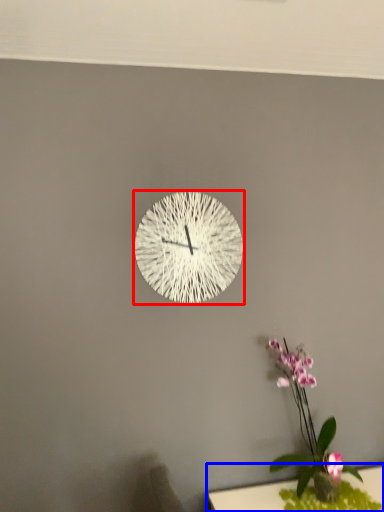
Question: Which point is further to the camera, wall clock (highlighted by a red box) or table (highlighted by a blue box)?

Choices:
 (A) wall clock
 (B) table

Answer: (A)